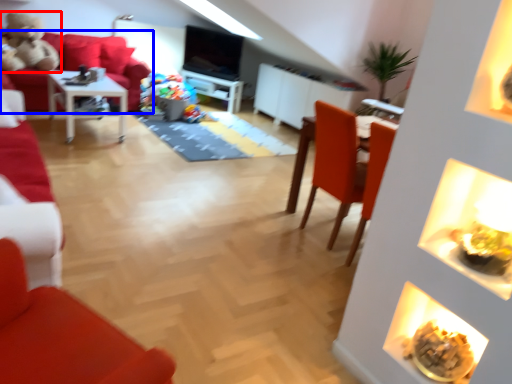
Question: Which of the following is the farthest to the observer, toy (highlighted by a red box) or studio couch (highlighted by a blue box)?

Choices:
 (A) toy
 (B) studio couch

Answer: (B)